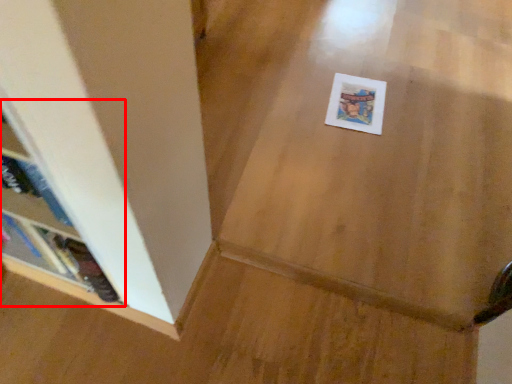
Question: In this image, where is shelf (annotated by the red box) located relative to postcard?

Choices:
 (A) left
 (B) right

Answer: (A)